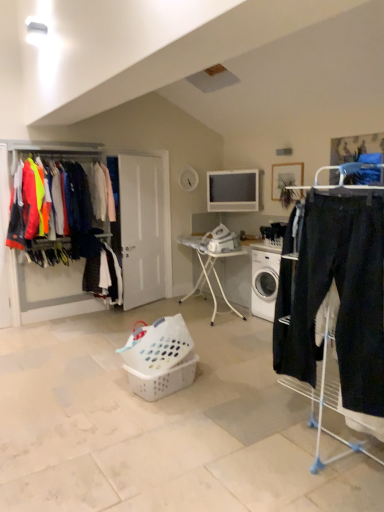
Question: Is white plastic lampshade at upper center shorter than white plastic basket at center, positioned as the first basket in bottom-to-top order?

Choices:
 (A) no
 (B) yes

Answer: (B)

Question: From the image's perspective, is white plastic lampshade at upper center on white plastic basket at center, positioned as the first basket in bottom-to-top order?

Choices:
 (A) no
 (B) yes

Answer: (B)

Question: Is white plastic lampshade at upper center oriented towards white plastic basket at center, positioned as the first basket in bottom-to-top order?

Choices:
 (A) yes
 (B) no

Answer: (B)

Question: Does white plastic lampshade at upper center have a lesser width compared to white plastic basket at center, acting as the second basket starting from the top?

Choices:
 (A) yes
 (B) no

Answer: (A)

Question: Is white plastic lampshade at upper center bigger than white plastic basket at center, positioned as the first basket in bottom-to-top order?

Choices:
 (A) yes
 (B) no

Answer: (B)

Question: From the image's perspective, is white plastic laundry basket at center, which is the second basket from bottom to top, positioned above or below dark blue fabric pants at center, the 2th clothing positioned from the right?

Choices:
 (A) above
 (B) below

Answer: (B)

Question: Would you say white plastic laundry basket at center, which is the second basket from bottom to top, is to the left or to the right of dark blue fabric pants at center, the 2th clothing positioned from the right, in the picture?

Choices:
 (A) left
 (B) right

Answer: (B)

Question: Considering their positions, is white plastic laundry basket at center, acting as the first basket starting from the top, located in front of or behind dark blue fabric pants at center, the 2th clothing positioned from the right?

Choices:
 (A) front
 (B) behind

Answer: (A)

Question: In terms of height, does white plastic laundry basket at center, which is the second basket from bottom to top, look taller or shorter compared to dark blue fabric pants at center, which is counted as the 3th clothing, starting from the front?

Choices:
 (A) short
 (B) tall

Answer: (A)

Question: In terms of size, does matte black jacket at left, the 1th clothing when ordered from left to right, appear bigger or smaller than matte plastic clothes rack at left?

Choices:
 (A) big
 (B) small

Answer: (B)

Question: From the image's perspective, is matte black jacket at left, the 3th clothing from the right, above or below matte plastic clothes rack at left?

Choices:
 (A) below
 (B) above

Answer: (B)

Question: In the image, is matte black jacket at left, acting as the 2th clothing starting from the back, positioned in front of or behind matte plastic clothes rack at left?

Choices:
 (A) behind
 (B) front

Answer: (B)

Question: Based on their positions, is matte black jacket at left, the 1th clothing when ordered from left to right, located to the left or right of matte plastic clothes rack at left?

Choices:
 (A) left
 (B) right

Answer: (A)

Question: Visually, is white plastic lampshade at upper center positioned to the left or to the right of wooden picture frame at upper right?

Choices:
 (A) left
 (B) right

Answer: (A)

Question: Is white plastic lampshade at upper center bigger or smaller than wooden picture frame at upper right?

Choices:
 (A) big
 (B) small

Answer: (B)